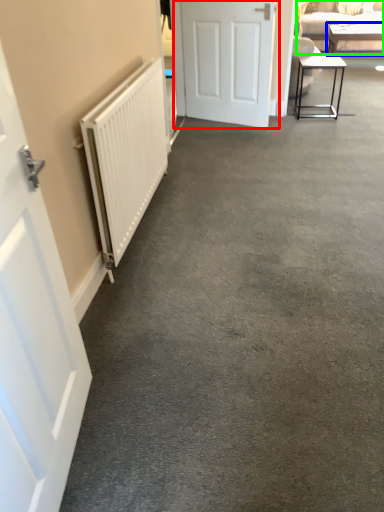
Question: Considering the real-world distances, which object is farthest from door (highlighted by a red box)? table (highlighted by a blue box) or studio couch (highlighted by a green box)?

Choices:
 (A) table
 (B) studio couch

Answer: (A)